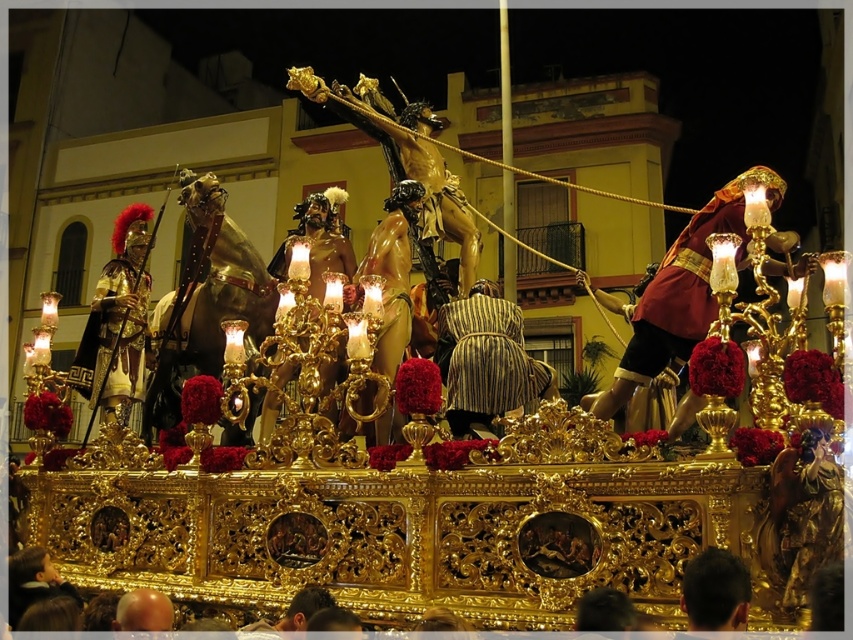
Can you confirm if matte gold statue at right is wider than smooth gold orb at center?

Yes, matte gold statue at right is wider than smooth gold orb at center.

Is matte gold statue at right closer to the viewer compared to smooth gold orb at center?

Yes, matte gold statue at right is in front of smooth gold orb at center.

Is point (654, 355) farther from camera compared to point (119, 627)?

That is True.

Image resolution: width=853 pixels, height=640 pixels. I want to click on matte gold statue at right, so click(675, 300).

Who is more forward, [323,260] or [706,572]?

Point [706,572]

In the scene shown: Can you confirm if gold polished statue at center is smaller than black hair at lower center?

No, gold polished statue at center is not smaller than black hair at lower center.

Who is more forward, [328,227] or [688,611]?

Point [688,611]

At what (x,y) coordinates should I click in order to perform the action: click on gold polished statue at center. Please return your answer as a coordinate pair (x, y). This screenshot has height=640, width=853. Looking at the image, I should click on (323, 237).

Is matte gold statue at right wider than gold polished statue at center?

Yes, matte gold statue at right is wider than gold polished statue at center.

Does point (633, 346) come in front of point (326, 380)?

Yes.

In the scene shown: Who is more forward, (618, 392) or (326, 228)?

Point (618, 392) is more forward.

Locate an element on the screen. The height and width of the screenshot is (640, 853). matte gold statue at right is located at coordinates (675, 300).